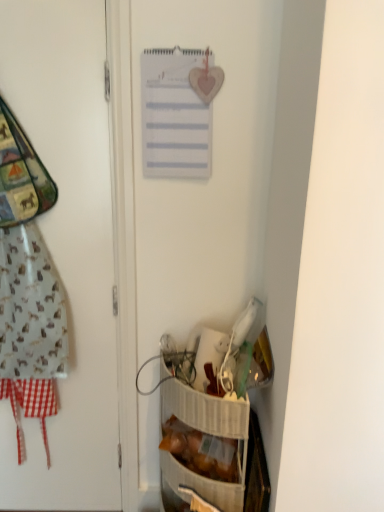
Question: Would you say translucent plastic bag of bread at lower right contains white matte door at left?

Choices:
 (A) yes
 (B) no

Answer: (B)

Question: Is translucent plastic bag of bread at lower right oriented towards white matte door at left?

Choices:
 (A) yes
 (B) no

Answer: (B)

Question: From the image's perspective, is translucent plastic bag of bread at lower right located above white matte door at left?

Choices:
 (A) yes
 (B) no

Answer: (B)

Question: Is translucent plastic bag of bread at lower right facing away from white matte door at left?

Choices:
 (A) yes
 (B) no

Answer: (B)

Question: Is translucent plastic bag of bread at lower right completely or partially outside of white matte door at left?

Choices:
 (A) no
 (B) yes

Answer: (B)

Question: From the image's perspective, is translucent plastic bag of bread at lower right located above or below white matte door at left?

Choices:
 (A) above
 (B) below

Answer: (B)

Question: Would you say translucent plastic bag of bread at lower right is to the left or to the right of white matte door at left in the picture?

Choices:
 (A) left
 (B) right

Answer: (B)

Question: Choose the correct answer: Is translucent plastic bag of bread at lower right inside white matte door at left or outside it?

Choices:
 (A) outside
 (B) inside

Answer: (A)

Question: Considering the positions of translucent plastic bag of bread at lower right and white matte door at left in the image, is translucent plastic bag of bread at lower right wider or thinner than white matte door at left?

Choices:
 (A) wide
 (B) thin

Answer: (A)

Question: Considering their positions, is white paper calendar at upper center located in front of or behind white matte door at left?

Choices:
 (A) behind
 (B) front

Answer: (A)

Question: From their relative heights in the image, would you say white paper calendar at upper center is taller or shorter than white matte door at left?

Choices:
 (A) short
 (B) tall

Answer: (A)

Question: From a real-world perspective, is white paper calendar at upper center positioned above or below white matte door at left?

Choices:
 (A) above
 (B) below

Answer: (A)

Question: From the image's perspective, is white paper calendar at upper center located above or below white matte door at left?

Choices:
 (A) below
 (B) above

Answer: (B)

Question: In terms of width, does white paper calendar at upper center look wider or thinner when compared to translucent plastic bag of bread at lower right?

Choices:
 (A) thin
 (B) wide

Answer: (A)

Question: From the image's perspective, is white paper calendar at upper center above or below translucent plastic bag of bread at lower right?

Choices:
 (A) below
 (B) above

Answer: (B)